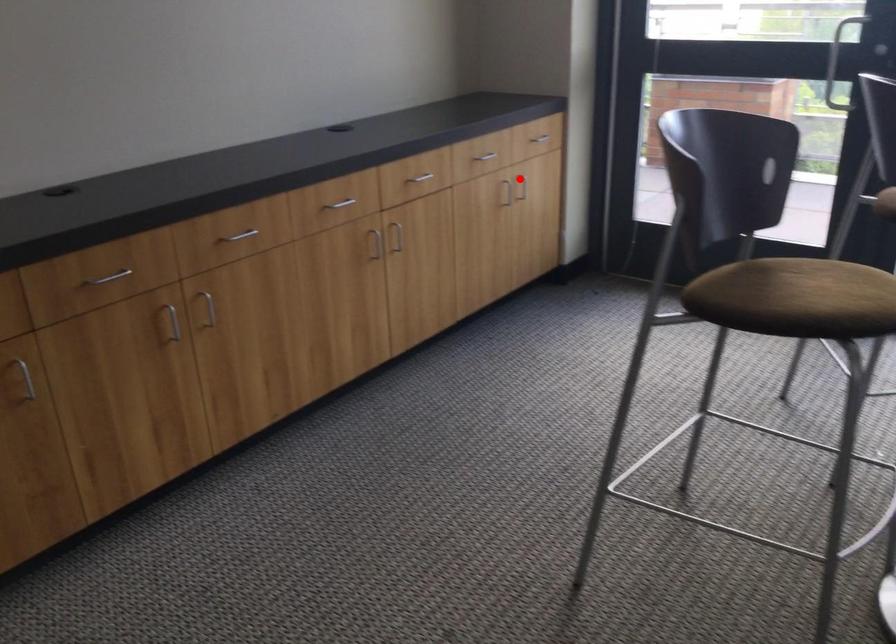
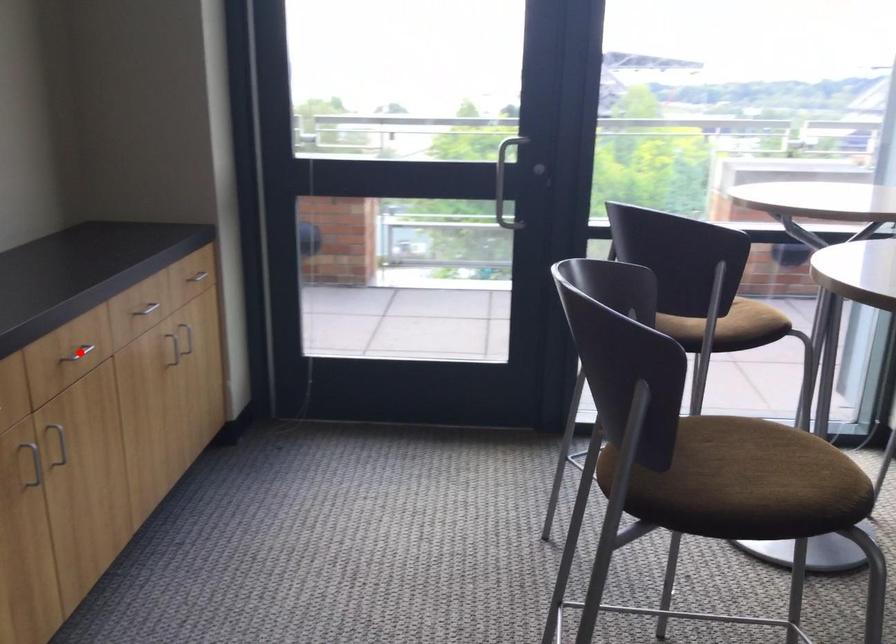
I am providing you with two images of the same scene from different viewpoints. A red point is marked on the first image and another point is marked on the second image. Does the point marked in image1 correspond to the same location as the one in image2?

No